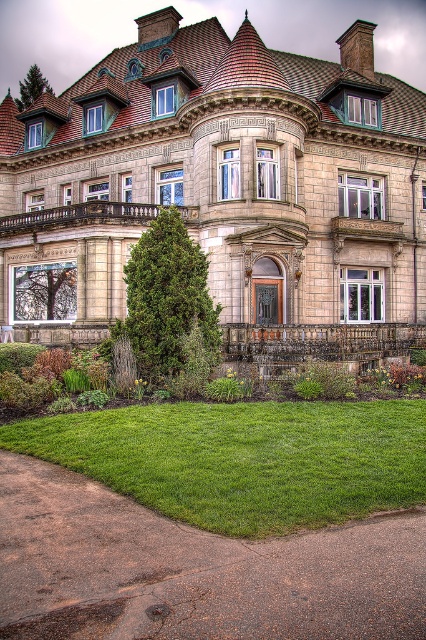
Question: Considering the relative positions of beige stone mansion at center and green lawn at lower center in the image provided, where is beige stone mansion at center located with respect to green lawn at lower center?

Choices:
 (A) right
 (B) left

Answer: (A)

Question: Which point is farther to the camera?

Choices:
 (A) (63, 289)
 (B) (161, 481)

Answer: (A)

Question: Which point appears closest to the camera in this image?

Choices:
 (A) (129, 157)
 (B) (51, 426)

Answer: (B)

Question: Can you confirm if beige stone mansion at center is thinner than green lawn at lower center?

Choices:
 (A) no
 (B) yes

Answer: (A)

Question: Is beige stone mansion at center positioned before green lawn at lower center?

Choices:
 (A) yes
 (B) no

Answer: (B)

Question: Among these objects, which one is nearest to the camera?

Choices:
 (A) beige stone mansion at center
 (B) green lawn at lower center

Answer: (B)